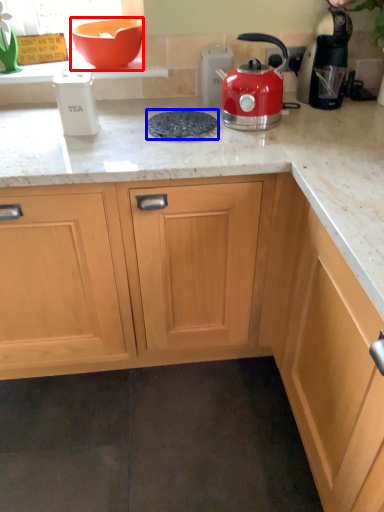
Question: Which object is further to the camera taking this photo, bowl (highlighted by a red box) or gas stove (highlighted by a blue box)?

Choices:
 (A) bowl
 (B) gas stove

Answer: (A)